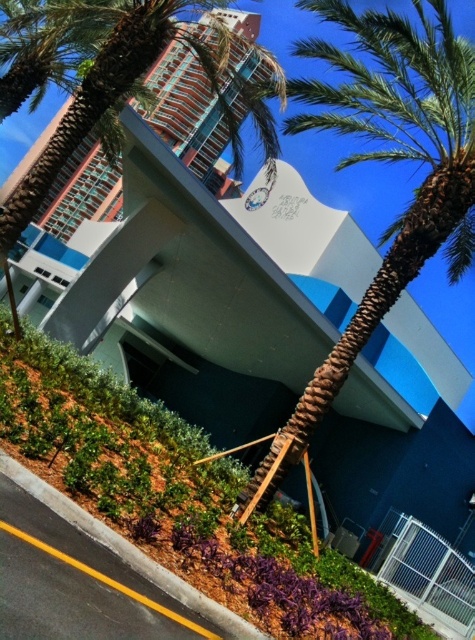
You are standing in front of the modern architectural structure described. You want to take a photo of the entrance area while staying within the paved road marked with a yellow line. Can you step closer to the brown textured palm tree at center to get a better angle without leaving the road?

The brown textured palm tree at center is 6.83 meters away from the viewer, so stepping closer to it would require moving beyond the paved road marked with a yellow line. Therefore, you cannot get closer to the palm tree without leaving the road.

You are a landscape architect designing a pathway between the brown textured palm tree at center and the green leafy palm tree at center. The pathway must be at least 10 feet wide to accommodate wheelchairs. Based on the scene description, will the existing space between the two palm trees be sufficient?

The distance between the brown textured palm tree at center and the green leafy palm tree at center is 15.48 feet, which is wider than the required 10 feet. Therefore, the existing space is sufficient to accommodate a wheelchair accessible pathway.

You are standing at the entrance of the modern building and want to place a small decorative statue exactly at the point specified in the scene. The statue has a base that requires a flat, non textured surface. Can you place the statue at point point (387,161)?

The point (387,161) is on brown textured palm tree at center, which has a textured surface. Therefore, the statue cannot be placed there as it requires a flat, non textured surface.